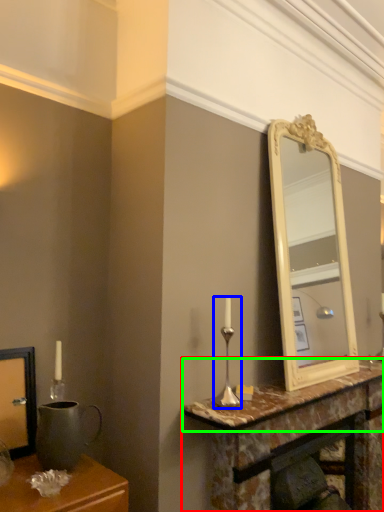
Question: Which is farther away from table (highlighted by a red box)? candle holder (highlighted by a blue box) or counter top (highlighted by a green box)?

Choices:
 (A) candle holder
 (B) counter top

Answer: (A)